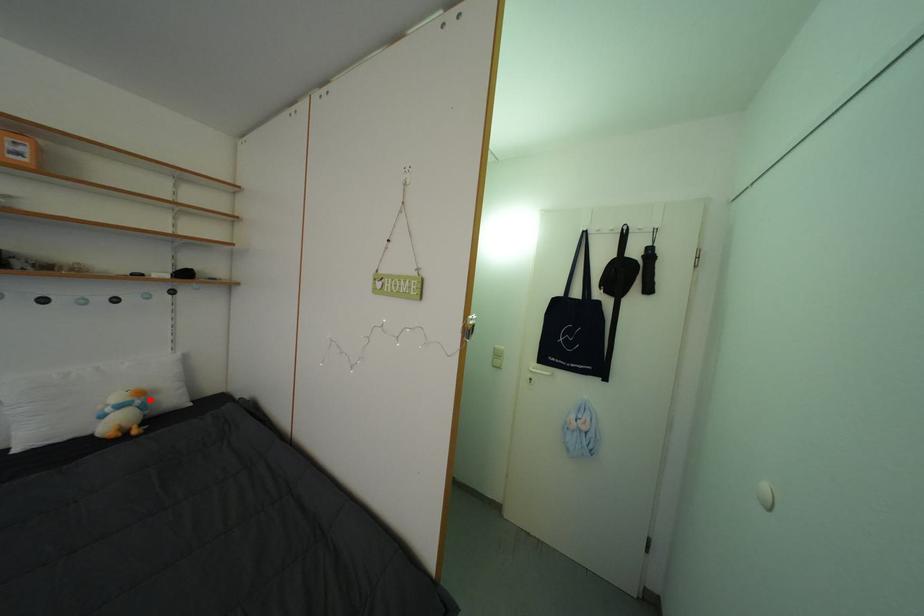
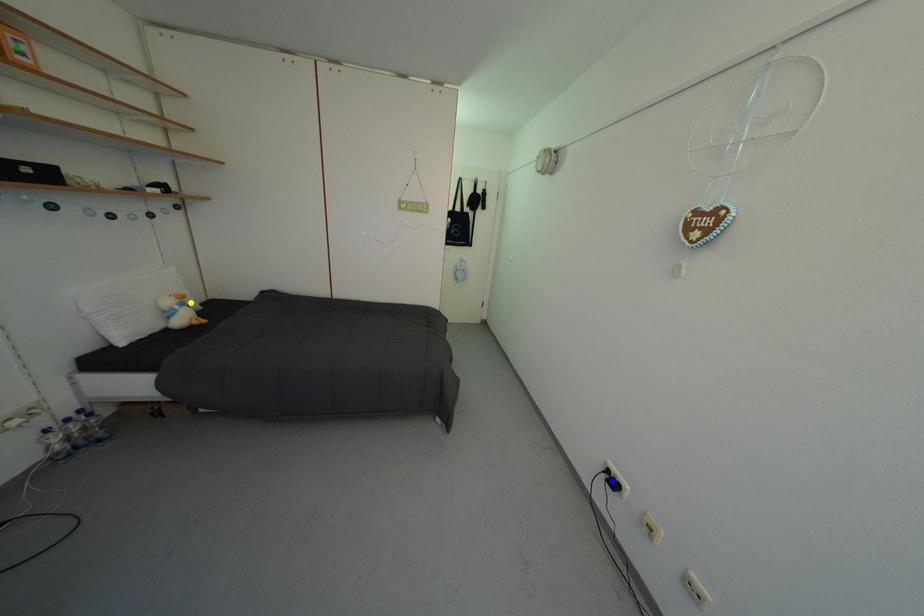
Question: I am providing you with two images of the same scene from different viewpoints. A red point is marked on the first image. You are given multiple points on the second image. Which point in image 2 is actually the same real-world point as the red point in image 1?

Choices:
 (A) yellow point
 (B) blue point
 (C) green point

Answer: (A)